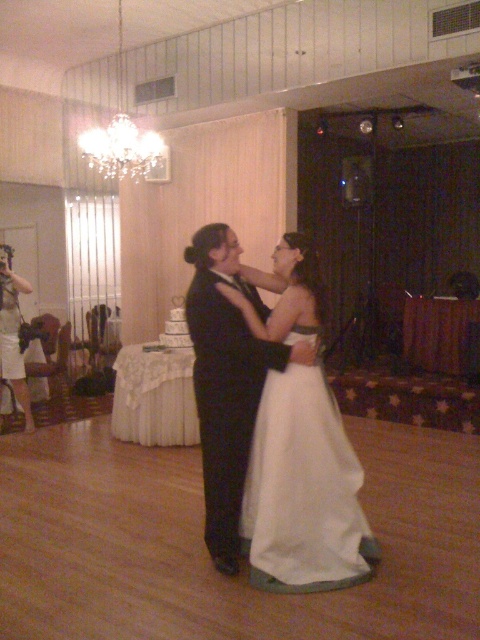
Which is more to the right, satin white dress at center or white satin dress at center?

white satin dress at center is more to the right.

Is satin white dress at center taller than white satin dress at center?

Yes.

Is point (264, 509) farther from camera compared to point (275, 508)?

Yes, point (264, 509) is behind point (275, 508).

The width and height of the screenshot is (480, 640). What are the coordinates of `satin white dress at center` in the screenshot? It's located at point(272,420).